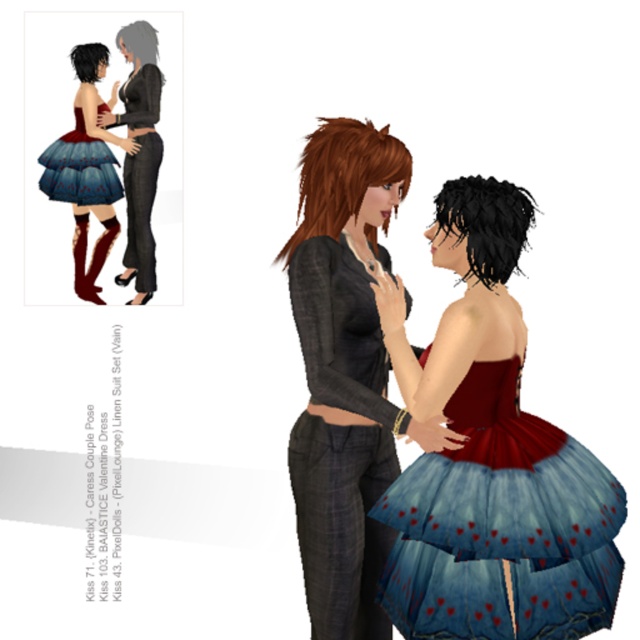
Based on the provided scene description, which object corresponds to the coordinates point (456, 410)?

The point (456, 410) corresponds to the matte black dress at center.

You are a photographer adjusting your camera settings to capture the scene. You notice the blue tulle skirt with red hearts at lower right and the matte black dress at left. Which object should you focus on first to ensure both are in sharp focus?

The blue tulle skirt with red hearts at lower right is closer to the viewer than the matte black dress at left. To ensure both are in sharp focus, you should focus on the blue tulle skirt with red hearts at lower right first since it is closer, and the depth of field may extend to the matte black dress at left.